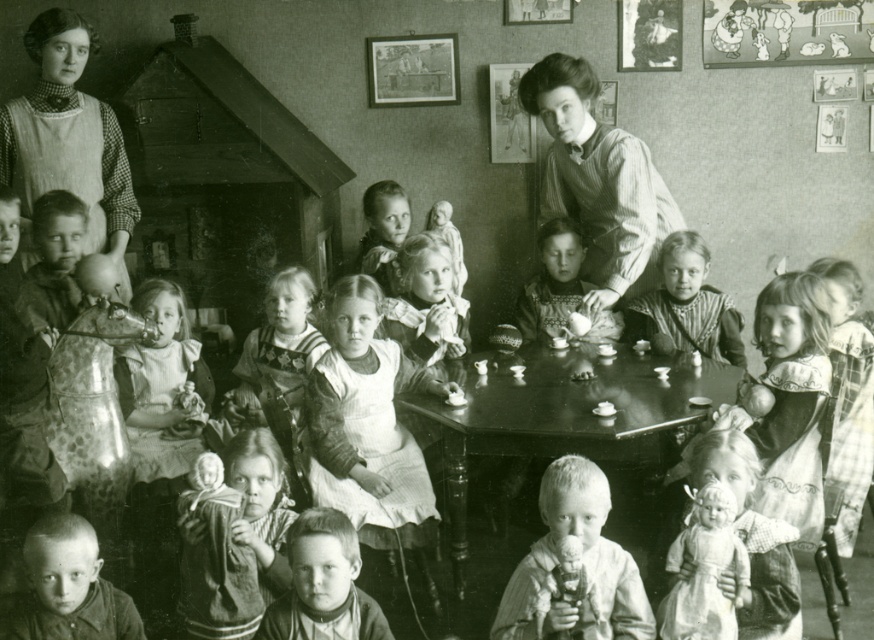
Question: Is smooth white doll at center in front of smooth porcelain doll at center?

Choices:
 (A) no
 (B) yes

Answer: (B)

Question: Which point is closer to the camera?

Choices:
 (A) (560, 260)
 (B) (218, 616)
 (C) (546, 516)

Answer: (C)

Question: Can you confirm if checkered fabric dress at upper left is bigger than white cloth doll at lower right?

Choices:
 (A) yes
 (B) no

Answer: (A)

Question: Considering the relative positions of checkered fabric dress at upper left and smooth brown shirt at lower left in the image provided, where is checkered fabric dress at upper left located with respect to smooth brown shirt at lower left?

Choices:
 (A) left
 (B) right

Answer: (A)

Question: Which of the following is the closest to the observer?

Choices:
 (A) (612, 605)
 (B) (258, 609)
 (C) (573, 132)
 (D) (394, 268)

Answer: (A)

Question: Which object appears closest to the camera in this image?

Choices:
 (A) smooth brown hair at center
 (B) white cloth doll at lower right
 (C) wooden dark brown table at center
 (D) checkered fabric dress at upper left

Answer: (A)